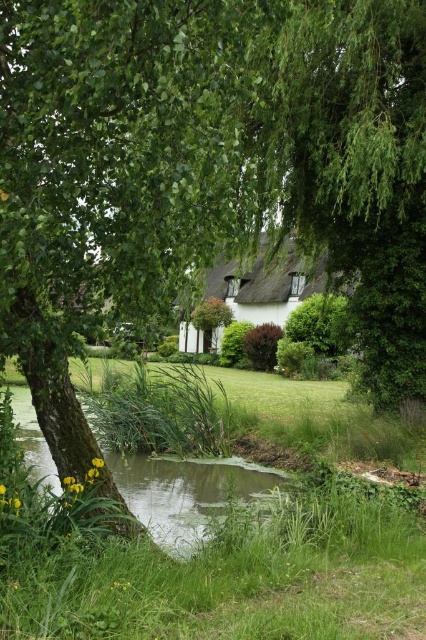
Based on the photo, you are standing at the edge of the pond and want to walk to the thatched roof cottage at center. Which direction should you head to avoid stepping on the green grass at lower left?

To reach the thatched roof cottage at center without stepping on the green grass at lower left, you should move towards the right side of the cottage since the grass is in front of it on the lower left.